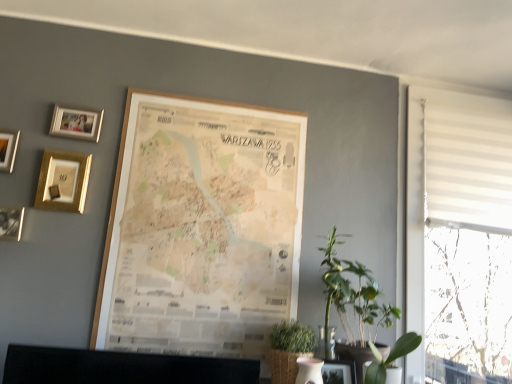
Question: Considering the relative sizes of matte gold picture frame at upper left, acting as the 2th picture frame starting from the left, and wooden photo frame at upper left, which appears as the sixth picture frame when viewed from the right, in the image provided, is matte gold picture frame at upper left, acting as the 2th picture frame starting from the left, smaller than wooden photo frame at upper left, which appears as the sixth picture frame when viewed from the right,?

Choices:
 (A) no
 (B) yes

Answer: (B)

Question: From the image's perspective, is matte gold picture frame at upper left, acting as the 2th picture frame starting from the left, above wooden photo frame at upper left, which appears as the sixth picture frame when viewed from the right?

Choices:
 (A) yes
 (B) no

Answer: (B)

Question: Is matte gold picture frame at upper left, which ranks as the 5th picture frame in right-to-left order, wider than wooden photo frame at upper left, marked as the first picture frame in a left-to-right arrangement?

Choices:
 (A) yes
 (B) no

Answer: (B)

Question: Does matte gold picture frame at upper left, acting as the 2th picture frame starting from the left, appear on the left side of wooden photo frame at upper left, which appears as the sixth picture frame when viewed from the right?

Choices:
 (A) no
 (B) yes

Answer: (A)

Question: Is matte gold picture frame at upper left, acting as the 2th picture frame starting from the left, facing towards wooden photo frame at upper left, marked as the first picture frame in a left-to-right arrangement?

Choices:
 (A) yes
 (B) no

Answer: (B)

Question: In terms of width, does wooden photo frame at upper left, which appears as the sixth picture frame when viewed from the right, look wider or thinner when compared to matte black picture frame at lower center, the 1th picture frame positioned from the right?

Choices:
 (A) thin
 (B) wide

Answer: (B)

Question: Do you think wooden photo frame at upper left, marked as the first picture frame in a left-to-right arrangement, is within matte black picture frame at lower center, the 1th picture frame positioned from the right, or outside of it?

Choices:
 (A) outside
 (B) inside

Answer: (A)

Question: From a real-world perspective, is wooden photo frame at upper left, marked as the first picture frame in a left-to-right arrangement, positioned above or below matte black picture frame at lower center, the 1th picture frame positioned from the right?

Choices:
 (A) above
 (B) below

Answer: (A)

Question: Is point (6, 168) positioned closer to the camera than point (334, 377)?

Choices:
 (A) farther
 (B) closer

Answer: (A)

Question: Looking at the image, does matte black picture frame at lower center, the sixth picture frame in the left-to-right sequence, seem bigger or smaller compared to green leafy plant at lower right, which ranks as the second plant in left-to-right order?

Choices:
 (A) big
 (B) small

Answer: (B)

Question: From the image's perspective, relative to green leafy plant at lower right, which ranks as the second plant in left-to-right order, is matte black picture frame at lower center, the 1th picture frame positioned from the right, above or below?

Choices:
 (A) above
 (B) below

Answer: (B)

Question: From a real-world perspective, is matte black picture frame at lower center, the sixth picture frame in the left-to-right sequence, physically located above or below green leafy plant at lower right, which ranks as the second plant in left-to-right order?

Choices:
 (A) below
 (B) above

Answer: (A)

Question: Do you think matte black picture frame at lower center, the sixth picture frame in the left-to-right sequence, is within green leafy plant at lower right, positioned as the 1th plant in right-to-left order, or outside of it?

Choices:
 (A) outside
 (B) inside

Answer: (A)

Question: Is matte gold picture frame at upper left, the third picture frame in the right-to-left sequence, wider or thinner than green leafy plant at right, the first plant viewed from the left?

Choices:
 (A) wide
 (B) thin

Answer: (B)

Question: From the image's perspective, is matte gold picture frame at upper left, the 4th picture frame when ordered from left to right, above or below green leafy plant at right, the first plant viewed from the left?

Choices:
 (A) below
 (B) above

Answer: (B)